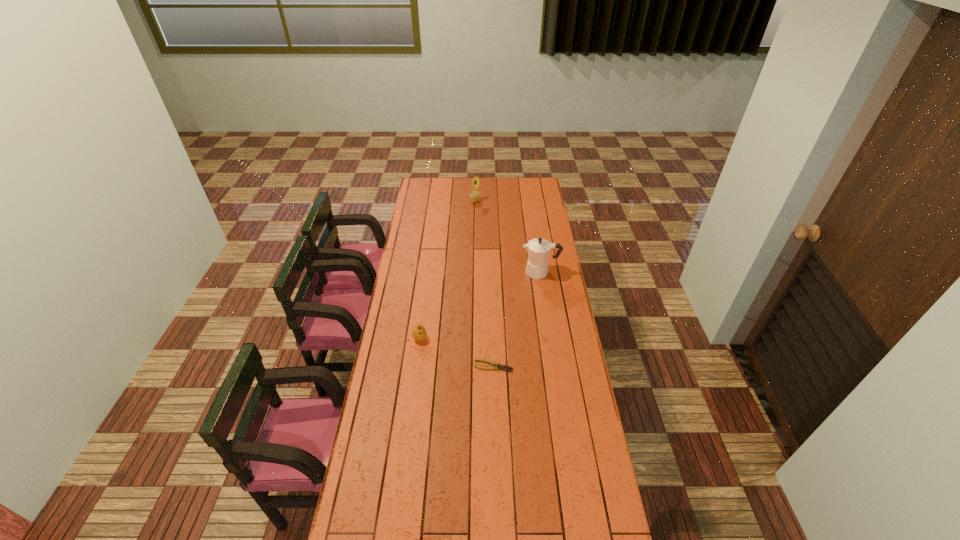
Identify the location of free space located 0.370m at the spout of the third nearest object. The image size is (960, 540). coord(449,272).

I want to click on free region located 0.120m on the face of the sunflower, so click(499, 201).

This screenshot has height=540, width=960. Find the location of `vacant space located 0.140m on the front of the third tallest object`. vacant space located 0.140m on the front of the third tallest object is located at coordinates (414, 373).

Locate an element on the screen. free space located 0.180m on the right of the nearest object is located at coordinates (556, 366).

Find the location of `object present at the left edge`. object present at the left edge is located at coordinates point(419,333).

Where is `object that is positioned at the right edge`? object that is positioned at the right edge is located at coordinates (538, 249).

The image size is (960, 540). Find the location of `vacant space at the far edge of the desktop`. vacant space at the far edge of the desktop is located at coordinates (450, 191).

In order to click on vacant point at the left edge in this screenshot , I will do `click(370, 445)`.

The height and width of the screenshot is (540, 960). In order to click on free point at the right edge in this screenshot , I will do point(526,240).

In the image, there is a desktop. Identify the location of free space at the far left corner. Image resolution: width=960 pixels, height=540 pixels. (420, 192).